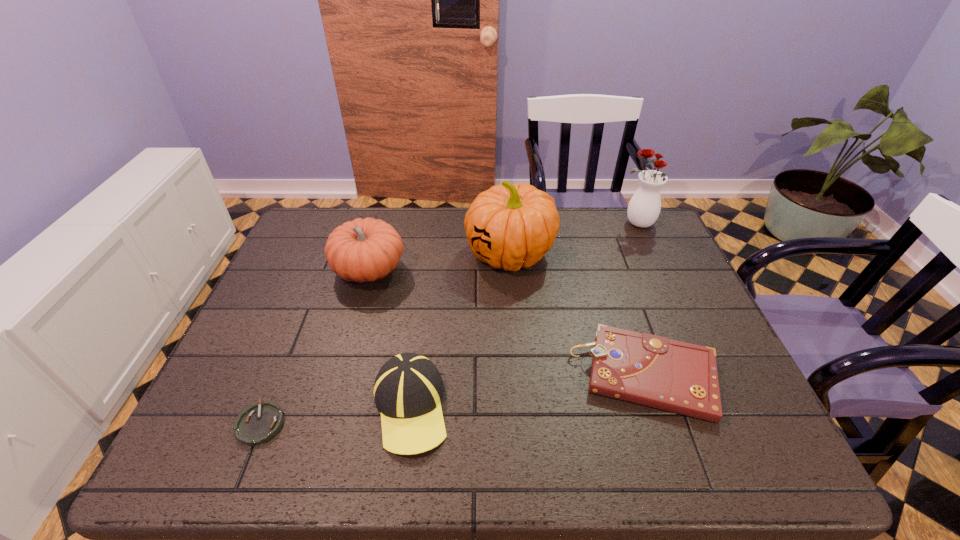
This screenshot has height=540, width=960. Identify the location of empty space between the right pumpkin and the notebook. (578, 314).

Where is `vacant area that lies between the second shortest object and the right pumpkin`? Image resolution: width=960 pixels, height=540 pixels. vacant area that lies between the second shortest object and the right pumpkin is located at coordinates (578, 314).

The width and height of the screenshot is (960, 540). Find the location of `free space between the shortest object and the taller pumpkin`. free space between the shortest object and the taller pumpkin is located at coordinates click(x=385, y=339).

Find the location of a particular element. Image resolution: width=960 pixels, height=540 pixels. free space between the baseball cap and the third tallest object is located at coordinates (390, 339).

Locate an element on the screen. This screenshot has height=540, width=960. free area in between the right pumpkin and the left pumpkin is located at coordinates click(440, 262).

Find the location of a particular element. The height and width of the screenshot is (540, 960). vacant space that's between the shorter pumpkin and the shortest object is located at coordinates pos(315,347).

The image size is (960, 540). Find the location of `vacant region between the taller pumpkin and the shortest object`. vacant region between the taller pumpkin and the shortest object is located at coordinates (385, 339).

Where is `unoccupied area between the vase and the second shortest object`? This screenshot has height=540, width=960. unoccupied area between the vase and the second shortest object is located at coordinates (641, 300).

Where is `object that stands as the third closest to the baseball cap`? The image size is (960, 540). object that stands as the third closest to the baseball cap is located at coordinates (511, 226).

The width and height of the screenshot is (960, 540). In order to click on object that is the closest to the ashtray in this screenshot , I will do `click(408, 389)`.